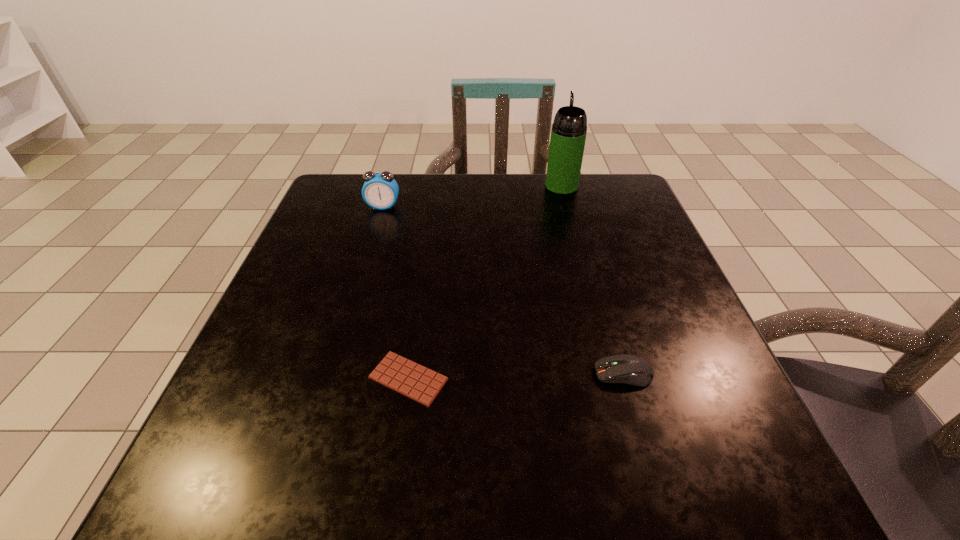
The image size is (960, 540). Identify the location of free space between the third tallest object and the candy bar. (516, 376).

At what (x,y) coordinates should I click in order to perform the action: click on free space between the second object from left to right and the computer equipment. Please return your answer as a coordinate pair (x, y). The image size is (960, 540). Looking at the image, I should click on (516, 376).

What are the coordinates of `free spot between the thermos bottle and the third shortest object` in the screenshot? It's located at pos(472,196).

This screenshot has width=960, height=540. I want to click on free space between the alarm clock and the thermos bottle, so click(x=472, y=196).

The width and height of the screenshot is (960, 540). Identify the location of unoccupied area between the farthest object and the second shortest object. click(x=592, y=280).

Locate an element on the screen. The width and height of the screenshot is (960, 540). free space between the third nearest object and the thermos bottle is located at coordinates (472, 196).

At what (x,y) coordinates should I click in order to perform the action: click on the third closest object relative to the farthest object. Please return your answer as a coordinate pair (x, y). The height and width of the screenshot is (540, 960). Looking at the image, I should click on (417, 382).

Identify the location of object that stands as the second closest to the candy bar. point(380,190).

This screenshot has height=540, width=960. Find the location of `blank area in the image that satisfies the following two spatial constraints: 1. on the button of the second shortest object; 2. on the front side of the second object from left to right`. blank area in the image that satisfies the following two spatial constraints: 1. on the button of the second shortest object; 2. on the front side of the second object from left to right is located at coordinates (625, 379).

I want to click on blank space that satisfies the following two spatial constraints: 1. on the face of the shortest object; 2. on the left side of the second tallest object, so click(x=332, y=379).